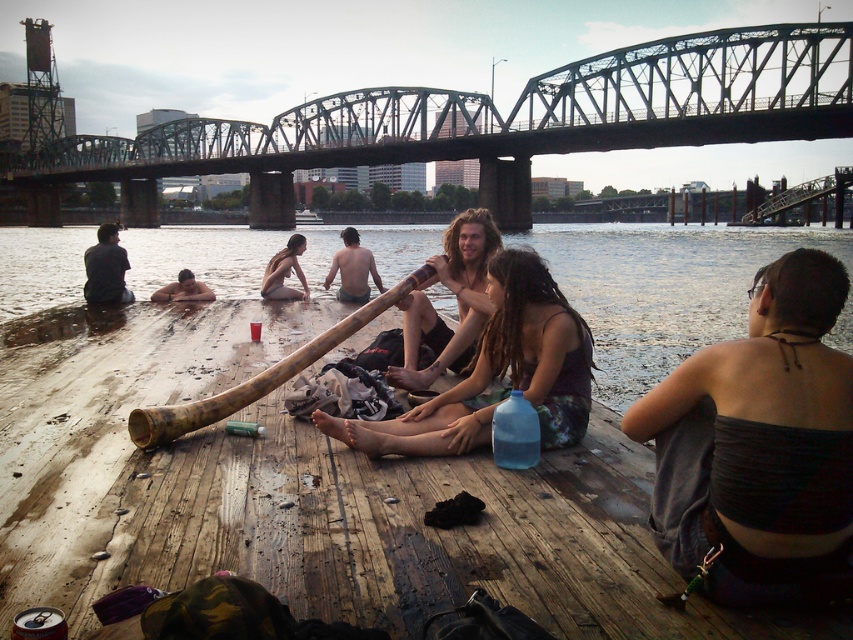
You are standing on the brown wooden dock at lower center and want to cross to the green steel bridge at upper center. Is the bridge directly above the dock, making it easy to climb up?

The green steel bridge at upper center is positioned over the brown wooden dock at lower center, so yes, it is directly above and you can easily climb up to it.

You are standing at the point marked by coordinates point (486, 122) in the image. What structure are you facing?

The point (486, 122) corresponds to the green steel bridge at upper center, so you are facing the green steel bridge at upper center.